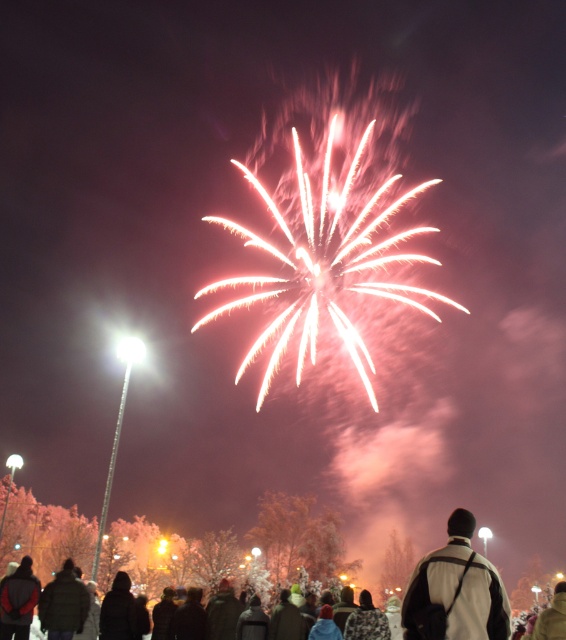
Where is `white matte jacket at center`? The image size is (566, 640). white matte jacket at center is located at coordinates (456, 592).

Does white matte jacket at center appear on the left side of dark brown leather jacket at lower left?

No, white matte jacket at center is not to the left of dark brown leather jacket at lower left.

I want to click on white matte jacket at center, so click(x=456, y=592).